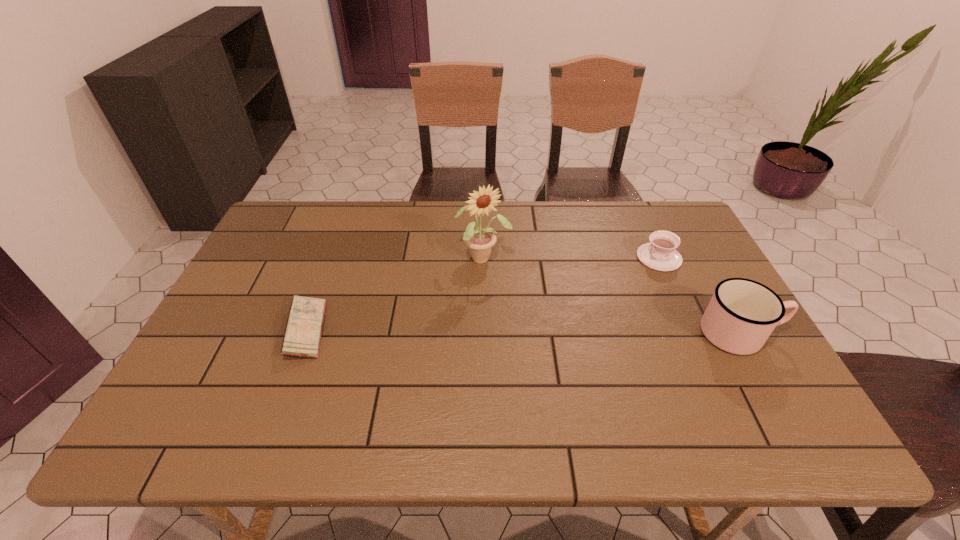
You are a GUI agent. You are given a task and a screenshot of the screen. Output one action in this format:
    pyautogui.click(x=<x>, y=<y>)
    Task: Click on the empty space that is in between the second tallest object and the sunflower
    This screenshot has height=540, width=960.
    Given the screenshot: What is the action you would take?
    pyautogui.click(x=612, y=296)

Find the location of a particular element. free space between the sunflower and the teacup is located at coordinates (571, 258).

Identify the location of object that ranks as the second closest to the teacup. The height and width of the screenshot is (540, 960). (480, 241).

This screenshot has width=960, height=540. Identify the location of the second closest object to the teacup. (480, 241).

This screenshot has height=540, width=960. I want to click on free point that satisfies the following two spatial constraints: 1. on the front side of the mug; 2. on the side of the diary with the handle, so tap(305, 333).

Locate an element on the screen. The image size is (960, 540). vacant space that satisfies the following two spatial constraints: 1. on the back side of the tallest object; 2. on the right side of the diary is located at coordinates (333, 258).

Identify the location of free location that satisfies the following two spatial constraints: 1. on the front side of the leftmost object; 2. on the side of the mug with the handle. The height and width of the screenshot is (540, 960). (305, 333).

Find the location of a particular element. This screenshot has height=540, width=960. vacant region that satisfies the following two spatial constraints: 1. on the back side of the tallest object; 2. on the left side of the teacup is located at coordinates (483, 258).

This screenshot has height=540, width=960. In order to click on free spot that satisfies the following two spatial constraints: 1. on the front side of the third object from right to left; 2. on the side of the third shortest object with the handle in this screenshot , I will do `click(484, 333)`.

Locate an element on the screen. vacant region that satisfies the following two spatial constraints: 1. on the front side of the third shortest object; 2. on the side of the sunflower with the handle is located at coordinates (484, 333).